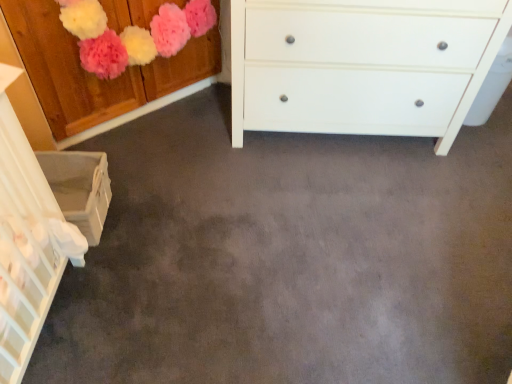
Question: Considering the positions of white matte chest of drawers at center and wooden cabinet at upper left, the 1th cabinetry positioned from the top, in the image, is white matte chest of drawers at center taller or shorter than wooden cabinet at upper left, the 1th cabinetry positioned from the top,?

Choices:
 (A) tall
 (B) short

Answer: (A)

Question: From a real-world perspective, is white matte chest of drawers at center physically located above or below wooden cabinet at upper left, the 1th cabinetry positioned from the top?

Choices:
 (A) above
 (B) below

Answer: (B)

Question: Which of these objects is positioned closest to the white matte chest of drawers at center?

Choices:
 (A) white woven basket at lower left, which is the 2th cabinetry from top to bottom
 (B) wooden cabinet at upper left, the second cabinetry in the bottom-to-top sequence

Answer: (B)

Question: Which object is positioned farthest from the white woven basket at lower left, which is the 2th cabinetry from top to bottom?

Choices:
 (A) wooden cabinet at upper left, the second cabinetry in the bottom-to-top sequence
 (B) white matte chest of drawers at center

Answer: (B)